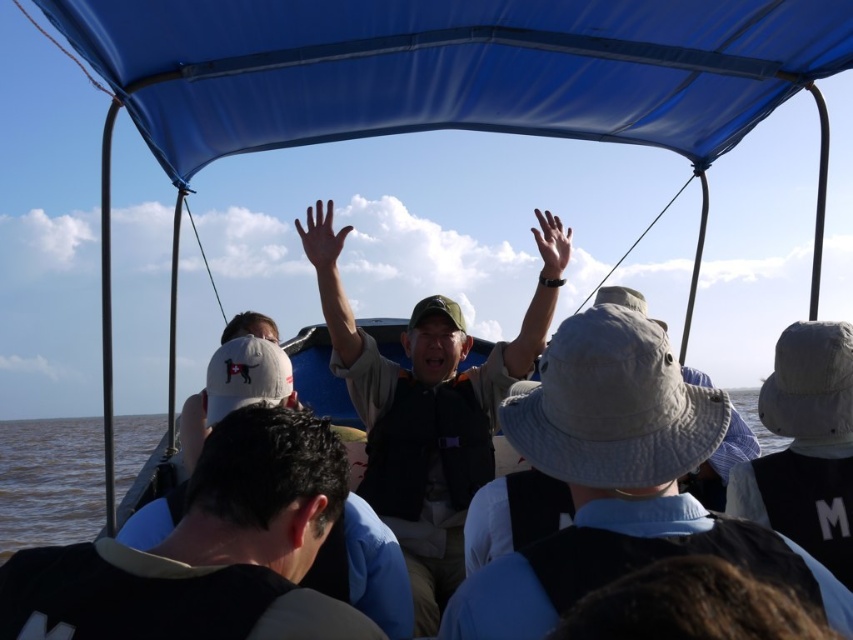
Between blue fabric canopy at upper center and brown water at lower left, which one appears on the right side from the viewer's perspective?

blue fabric canopy at upper center is more to the right.

Is blue fabric canopy at upper center to the left of brown water at lower left from the viewer's perspective?

No, blue fabric canopy at upper center is not to the left of brown water at lower left.

Does point (273, 4) come closer to viewer compared to point (93, 436)?

Yes, point (273, 4) is closer to viewer.

This screenshot has height=640, width=853. What are the coordinates of `blue fabric canopy at upper center` in the screenshot? It's located at (450, 68).